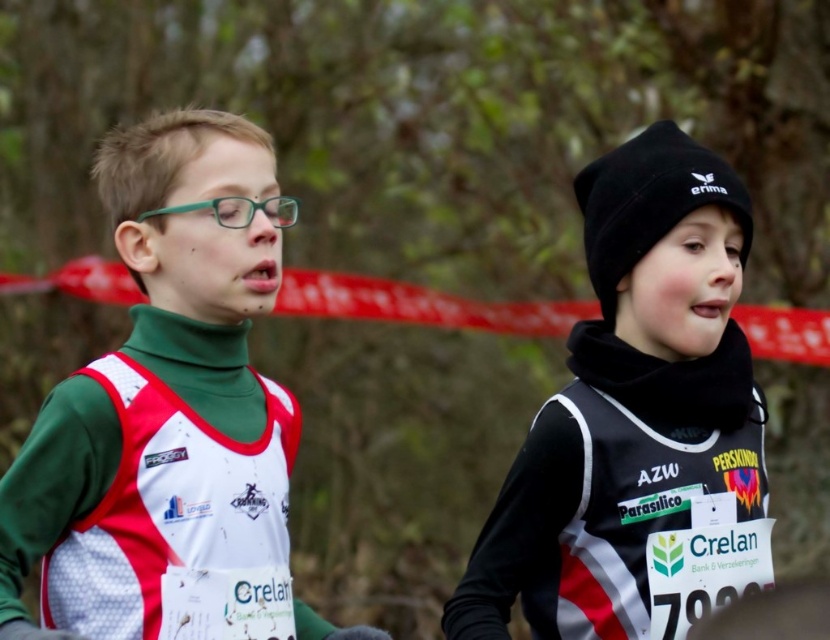
Which is above, black matte beanie at upper right or red tape at center?

red tape at center

Is point (619, 522) farther from camera compared to point (392, 285)?

No.

Locate an element on the screen. This screenshot has height=640, width=830. black matte beanie at upper right is located at coordinates (628, 403).

Is point (503, 493) positioned behind point (135, 317)?

Yes, it is.

Who is higher up, black matte beanie at upper right or matte green turtleneck at center?

matte green turtleneck at center is above.

Which is in front, point (758, 506) or point (130, 236)?

Positioned in front is point (130, 236).

Locate an element on the screen. This screenshot has height=640, width=830. black matte beanie at upper right is located at coordinates (628, 403).

Which is below, matte green turtleneck at center or red tape at center?

Positioned lower is matte green turtleneck at center.

Describe the element at coordinates (199, 256) in the screenshot. I see `matte green turtleneck at center` at that location.

Find the location of `matte green turtleneck at center`. matte green turtleneck at center is located at coordinates (199, 256).